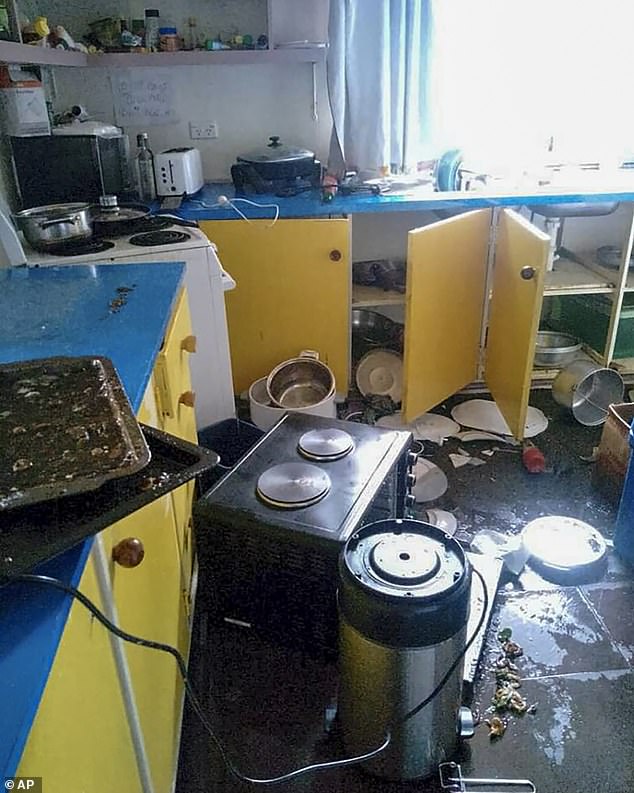
Image resolution: width=634 pixels, height=793 pixels. I want to click on toaster, so click(184, 167).